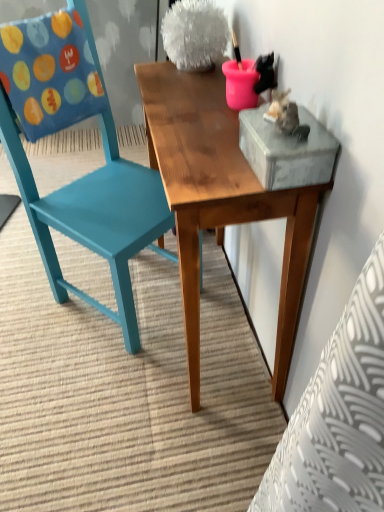
The height and width of the screenshot is (512, 384). I want to click on free space to the left of wooden table at center, so [x=52, y=343].